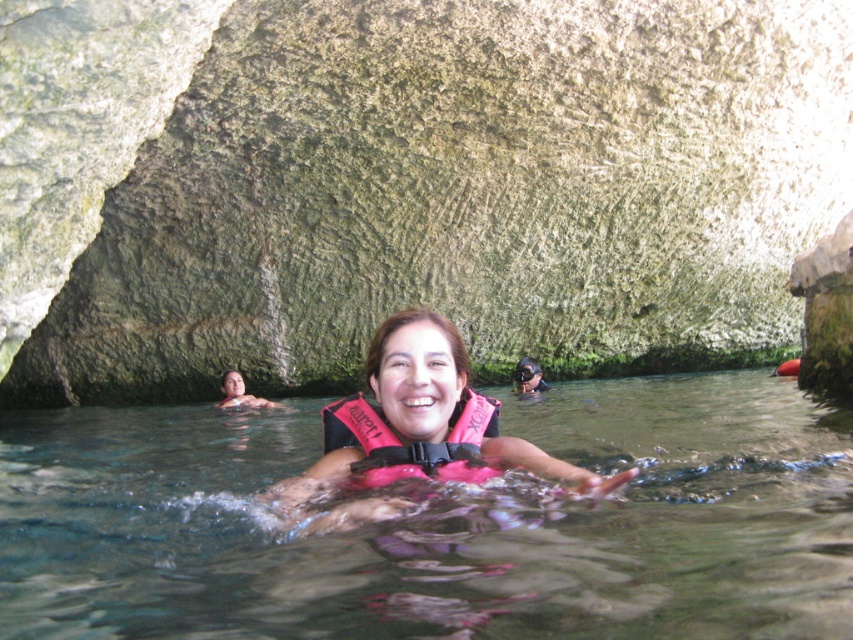
Question: Is pink fabric life jacket at center to the left of smooth skin face at lower left from the viewer's perspective?

Choices:
 (A) yes
 (B) no

Answer: (B)

Question: Among these points, which one is nearest to the camera?

Choices:
 (A) (460, 465)
 (B) (398, 436)

Answer: (A)

Question: Does clear water at center appear on the right side of transparent plastic goggles at center?

Choices:
 (A) no
 (B) yes

Answer: (A)

Question: Which object is the farthest from the transparent plastic goggles at center?

Choices:
 (A) smooth skin face at lower left
 (B) pink fabric life jacket at center

Answer: (B)

Question: Does clear water at center appear on the right side of transparent plastic goggles at center?

Choices:
 (A) no
 (B) yes

Answer: (A)

Question: Among these objects, which one is nearest to the camera?

Choices:
 (A) pink life vest at center
 (B) clear water at center

Answer: (B)